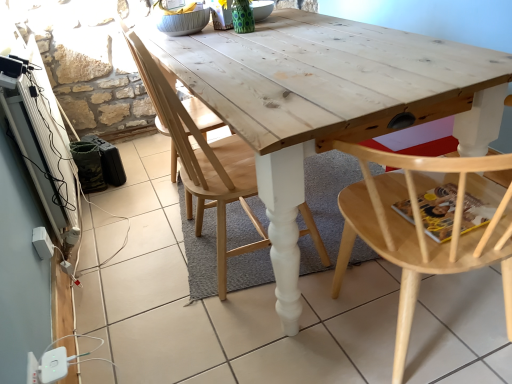
Where is `free spot to the left of natural wood chair at center, which ranks as the third chair in left-to-right order`? This screenshot has height=384, width=512. free spot to the left of natural wood chair at center, which ranks as the third chair in left-to-right order is located at coordinates (285, 336).